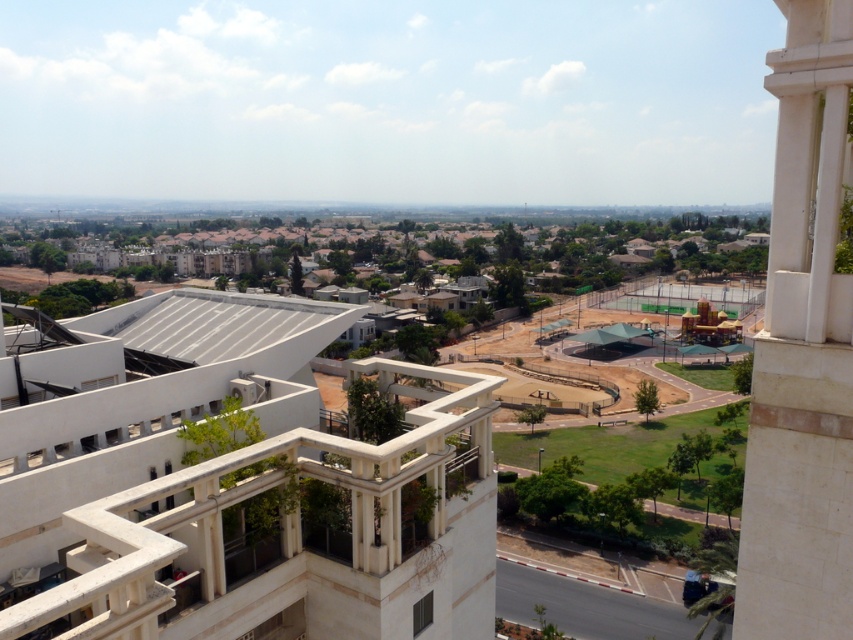
Question: Does white concrete balcony at center lie in front of white stone pillar at right?

Choices:
 (A) no
 (B) yes

Answer: (A)

Question: Is white concrete balcony at center to the left of white stone pillar at right from the viewer's perspective?

Choices:
 (A) yes
 (B) no

Answer: (A)

Question: Which object appears closest to the camera in this image?

Choices:
 (A) white stone pillar at right
 (B) white concrete balcony at center

Answer: (A)

Question: Does white concrete balcony at center appear under white stone pillar at right?

Choices:
 (A) no
 (B) yes

Answer: (B)